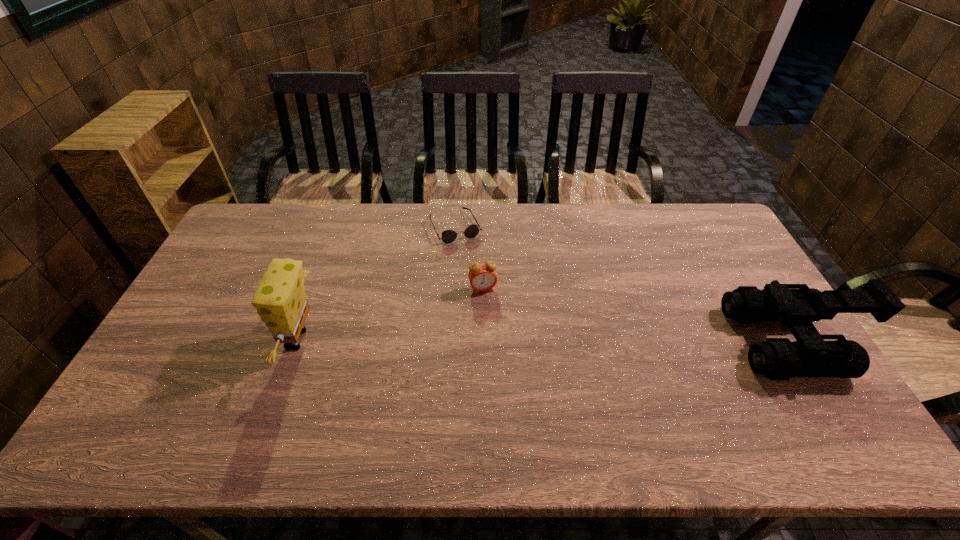
This screenshot has width=960, height=540. I want to click on sponge, so click(x=280, y=300).

Image resolution: width=960 pixels, height=540 pixels. I want to click on the leftmost object, so click(x=280, y=300).

Where is `the rightmost object`? This screenshot has height=540, width=960. the rightmost object is located at coordinates (796, 306).

Image resolution: width=960 pixels, height=540 pixels. I want to click on binoculars, so click(796, 306).

Identify the location of the second shortest object. Image resolution: width=960 pixels, height=540 pixels. (x=482, y=277).

This screenshot has height=540, width=960. I want to click on alarm clock, so click(482, 277).

Where is `the farthest object`? Image resolution: width=960 pixels, height=540 pixels. the farthest object is located at coordinates (448, 236).

This screenshot has height=540, width=960. I want to click on the shortest object, so click(448, 236).

Image resolution: width=960 pixels, height=540 pixels. I want to click on vacant space situated on the face of the leftmost object, so click(x=207, y=340).

Locate an element on the screen. The image size is (960, 540). free region located on the face of the leftmost object is located at coordinates (210, 340).